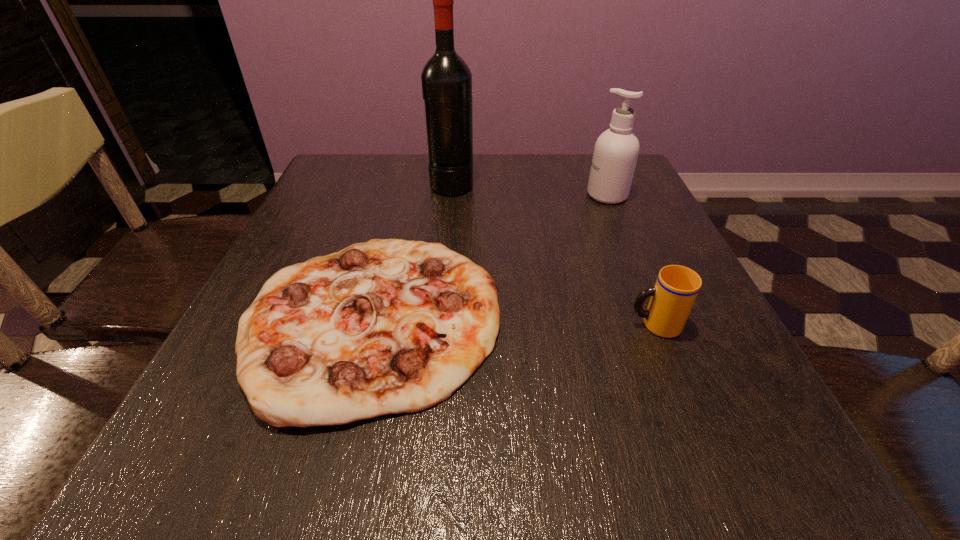
At what (x,y) coordinates should I click in order to perform the action: click on vacant region at the far edge of the desktop. Please return your answer as a coordinate pair (x, y). This screenshot has height=540, width=960. Looking at the image, I should click on (476, 173).

Where is `free region at the near edge of the desktop`? The height and width of the screenshot is (540, 960). free region at the near edge of the desktop is located at coordinates (592, 425).

Find the location of a particular element. The width and height of the screenshot is (960, 540). vacant space at the left edge of the desktop is located at coordinates [x=326, y=200].

In the image, there is a desktop. Identify the location of vacant region at the far left corner. This screenshot has width=960, height=540. (350, 161).

Where is `free space between the third shortest object and the wine bottle`? The width and height of the screenshot is (960, 540). free space between the third shortest object and the wine bottle is located at coordinates (530, 190).

Image resolution: width=960 pixels, height=540 pixels. I want to click on vacant area that lies between the third tallest object and the shortest object, so click(514, 322).

Find the location of `free space between the cup and the cleansing agent`. free space between the cup and the cleansing agent is located at coordinates (631, 260).

Where is `vacant area between the cup and the wine bottle`? Image resolution: width=960 pixels, height=540 pixels. vacant area between the cup and the wine bottle is located at coordinates (553, 254).

The width and height of the screenshot is (960, 540). I want to click on free spot between the cleansing agent and the shortest object, so click(x=490, y=257).

Identify the location of vacant space that is in between the wine bottle and the second shortest object. Image resolution: width=960 pixels, height=540 pixels. (553, 254).